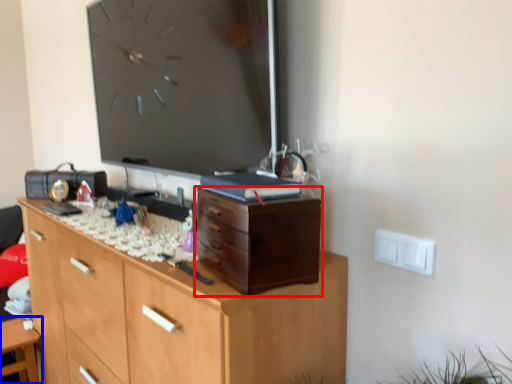
Question: Which of the following is the farthest to the observer, chest of drawers (highlighted by a red box) or table (highlighted by a blue box)?

Choices:
 (A) chest of drawers
 (B) table

Answer: (B)